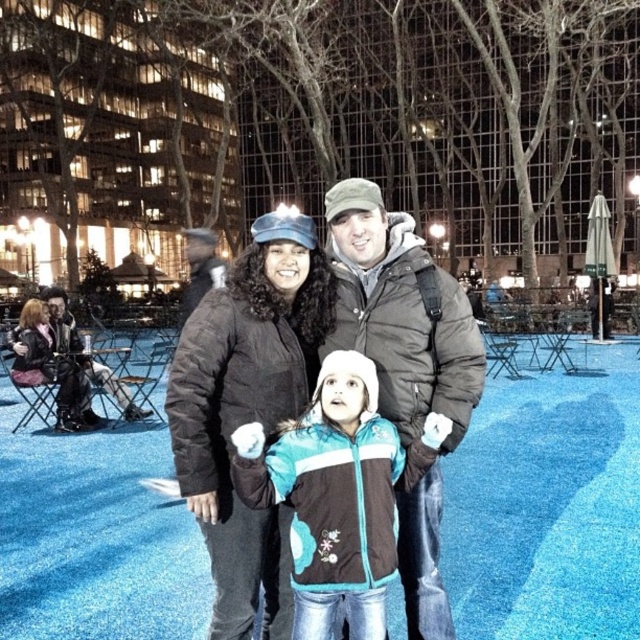
Question: Where is black puffy coat at center located in relation to dark brown puffy coat at center in the image?

Choices:
 (A) right
 (B) left

Answer: (B)

Question: Considering the relative positions of teal and white jacket at center and leather jacket at left in the image provided, where is teal and white jacket at center located with respect to leather jacket at left?

Choices:
 (A) right
 (B) left

Answer: (A)

Question: Which is farther from the leather jacket at left?

Choices:
 (A) dark brown puffy coat at center
 (B) teal and white jacket at center
 (C) black puffy coat at center

Answer: (B)

Question: Which object is positioned closest to the black puffy coat at center?

Choices:
 (A) leather jacket at left
 (B) dark brown puffy coat at center
 (C) teal and white jacket at center

Answer: (C)

Question: Considering the relative positions of dark brown puffy coat at center and teal and white jacket at center in the image provided, where is dark brown puffy coat at center located with respect to teal and white jacket at center?

Choices:
 (A) right
 (B) left

Answer: (A)

Question: Which of the following is the farthest from the observer?

Choices:
 (A) teal and white jacket at center
 (B) leather jacket at left

Answer: (B)